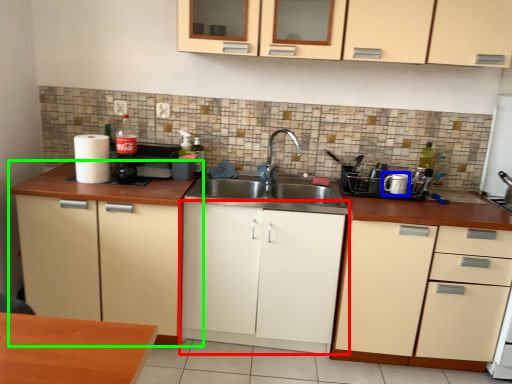
Question: Considering the real-world distances, which object is farthest from cabinetry (highlighted by a red box)? appliance (highlighted by a blue box) or cabinetry (highlighted by a green box)?

Choices:
 (A) appliance
 (B) cabinetry

Answer: (A)